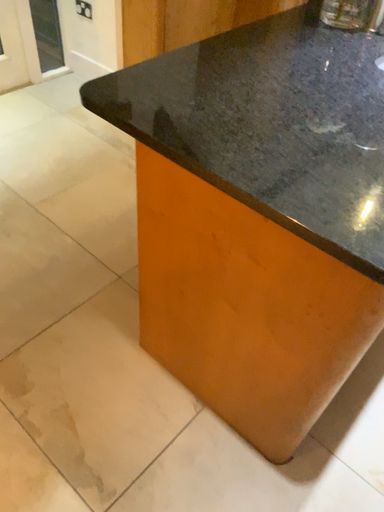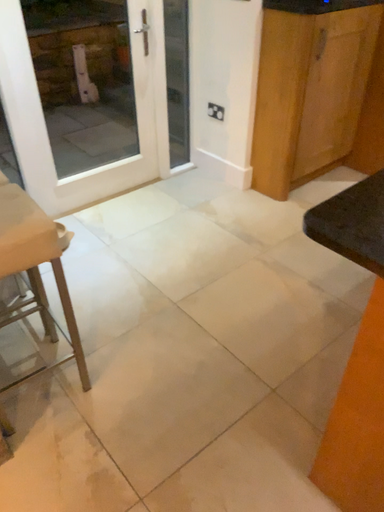
Question: How did the camera likely rotate when shooting the video?

Choices:
 (A) rotated left
 (B) rotated right

Answer: (A)